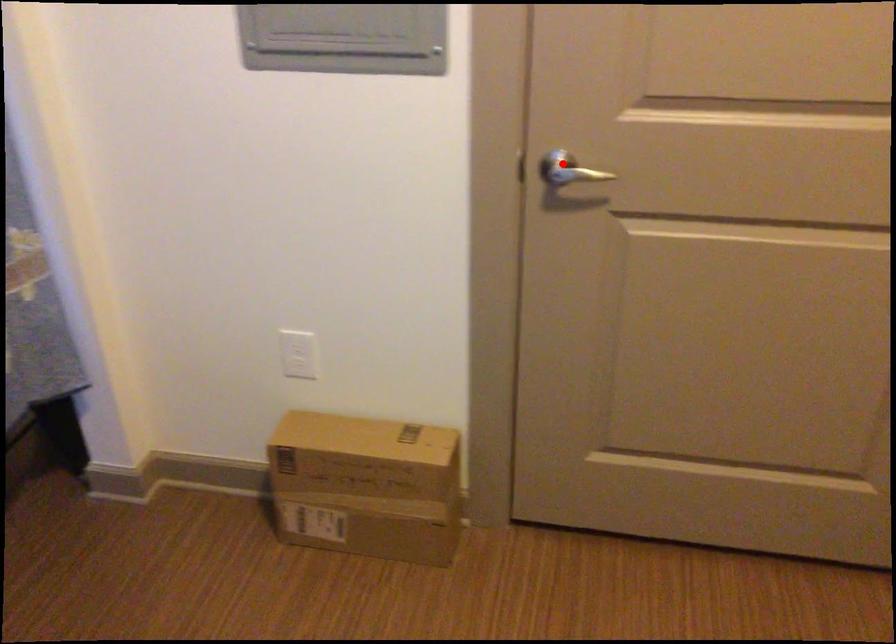
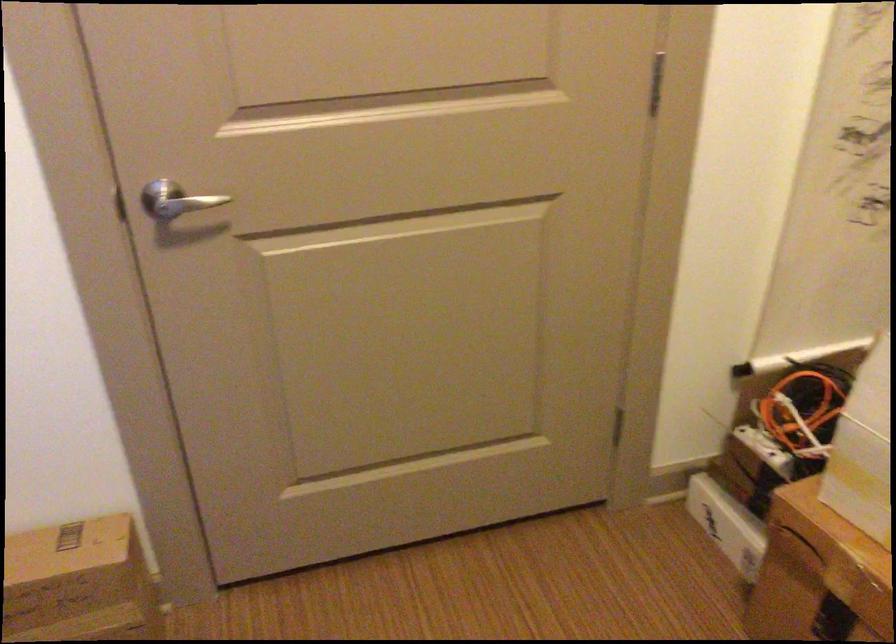
Question: A red point is marked in image1. In image2, is the corresponding 3D point closer to the camera or farther? Reply with the corresponding letter.

Choices:
 (A) The corresponding 3D point is closer.
 (B) The corresponding 3D point is farther.

Answer: (A)